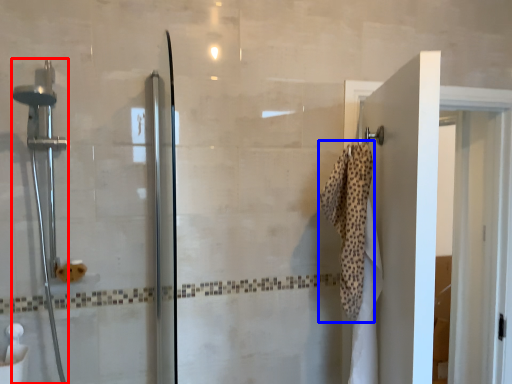
Question: Which object is further to the camera taking this photo, shower (highlighted by a red box) or bath towel (highlighted by a blue box)?

Choices:
 (A) shower
 (B) bath towel

Answer: (B)